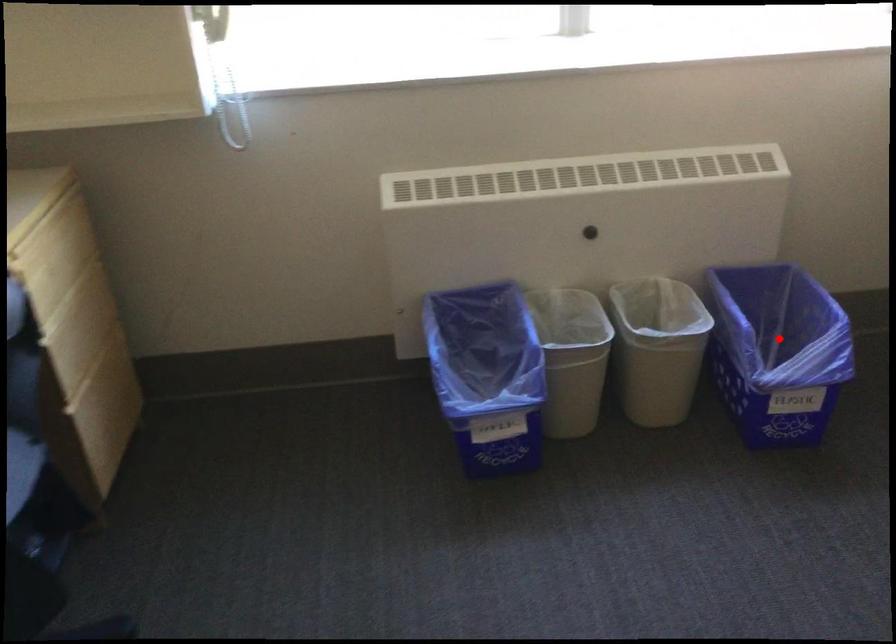
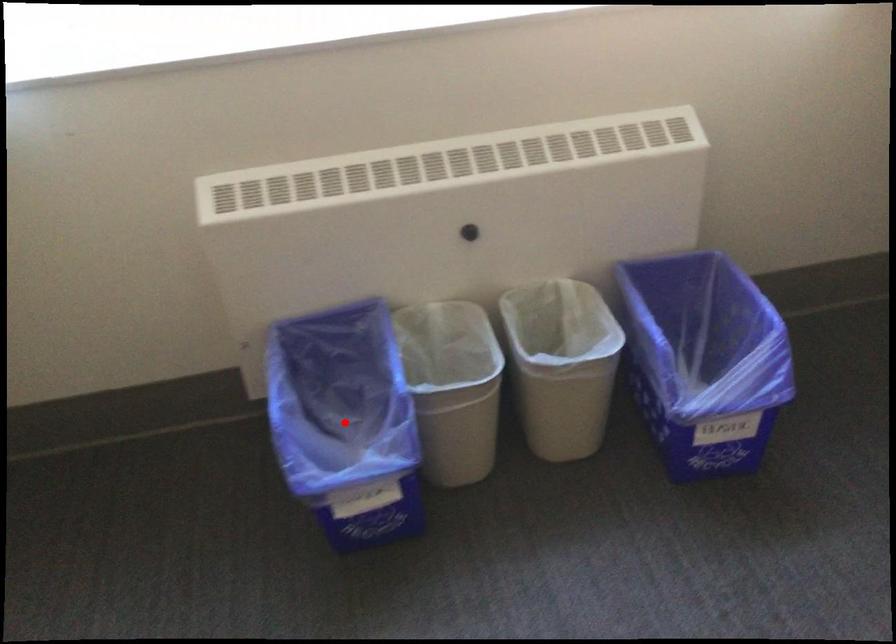
I am providing you with two images of the same scene from different viewpoints. A red point is marked on the first image and another point is marked on the second image. Is the red point in image1 aligned with the point shown in image2?

No